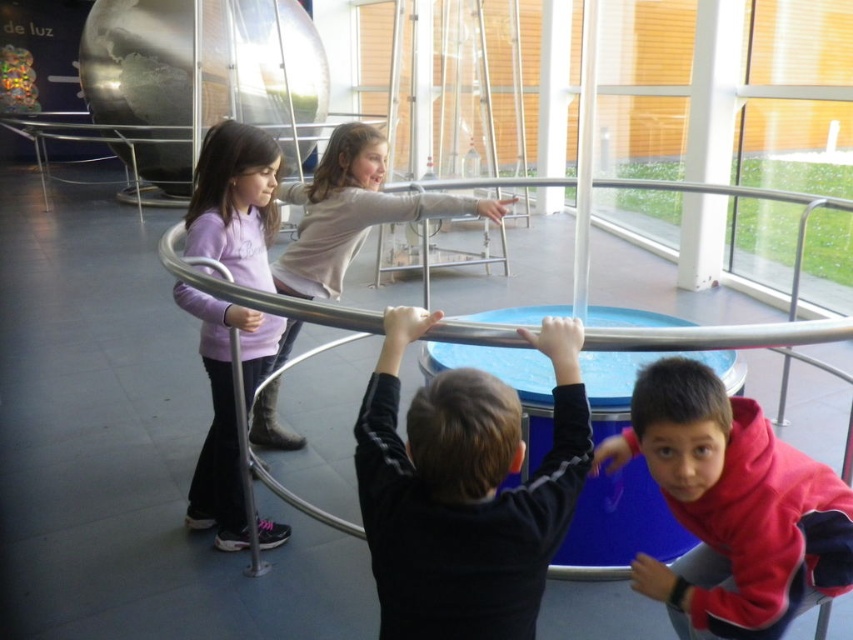
Question: Considering the relative positions of black matte shirt at center and red fleece jacket at lower right in the image provided, where is black matte shirt at center located with respect to red fleece jacket at lower right?

Choices:
 (A) left
 (B) right

Answer: (A)

Question: Is red fleece jacket at lower right above silver metallic hula hoop at center?

Choices:
 (A) yes
 (B) no

Answer: (B)

Question: Based on their relative distances, which object is farther from the silver metallic hula hoop at center?

Choices:
 (A) matte pink sweatshirt at center
 (B) matte gray shirt at center
 (C) black matte shirt at center
 (D) red fleece jacket at lower right

Answer: (C)

Question: Which point appears farthest from the camera in this image?

Choices:
 (A) (666, 339)
 (B) (373, 200)
 (C) (242, 182)

Answer: (B)

Question: Where is red fleece jacket at lower right located in relation to matte pink sweatshirt at center in the image?

Choices:
 (A) below
 (B) above

Answer: (A)

Question: Estimate the real-world distances between objects in this image. Which object is closer to the matte gray shirt at center?

Choices:
 (A) red fleece jacket at lower right
 (B) silver metallic hula hoop at center
 (C) matte pink sweatshirt at center
 (D) black matte shirt at center

Answer: (C)